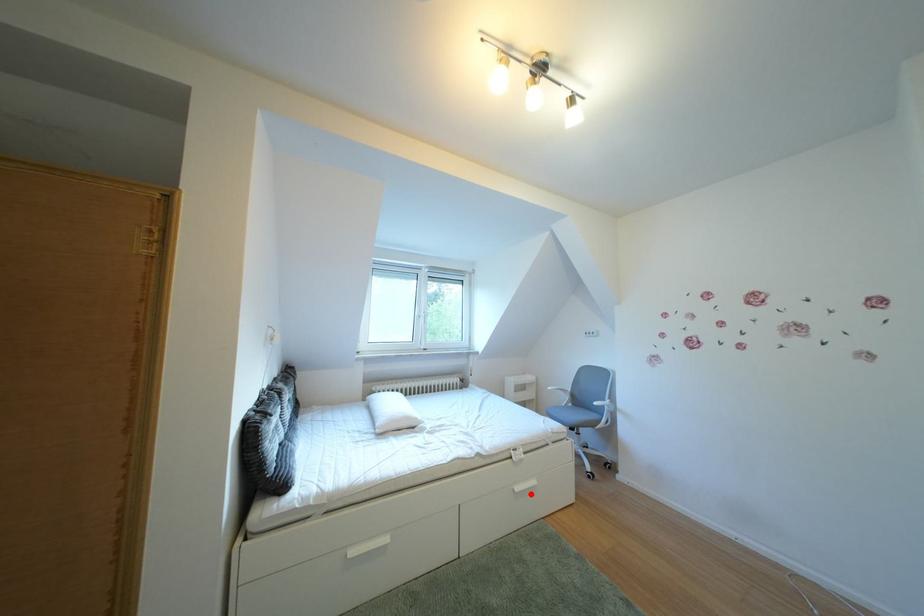
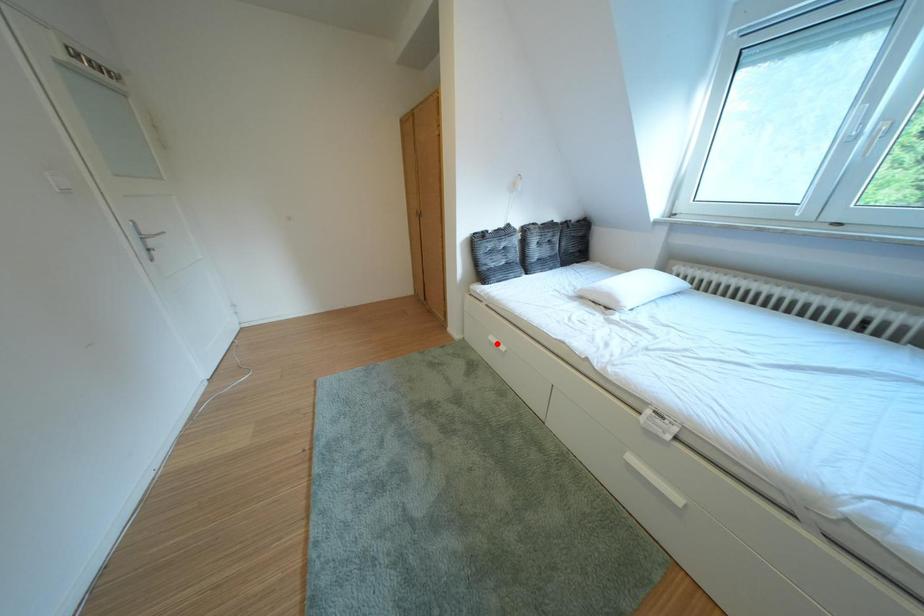
I am providing you with two images of the same scene from different viewpoints. A red point is marked on the first image and another point is marked on the second image. Do the highlighted points in image1 and image2 indicate the same real-world spot?

No